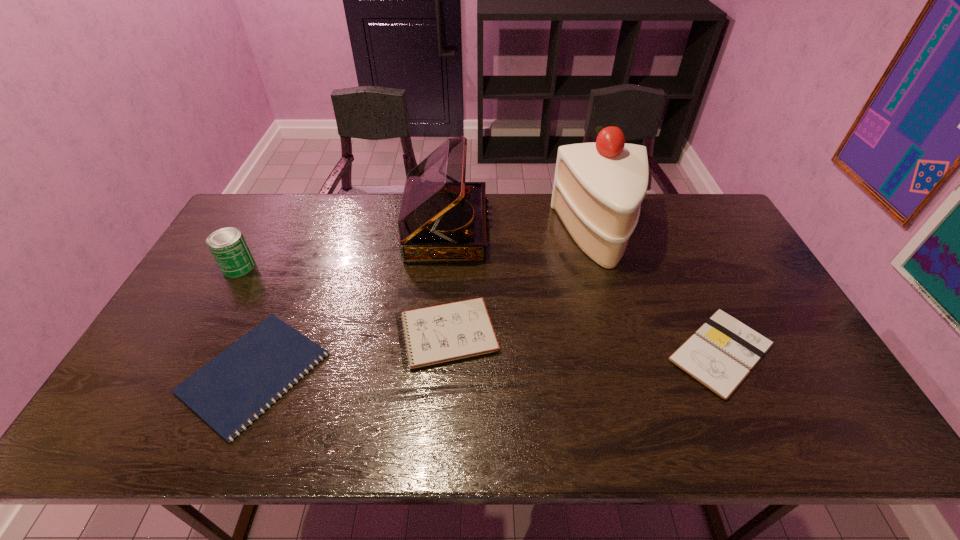
At what (x,y) coordinates should I click in order to perform the action: click on cake. Please return your answer as a coordinate pair (x, y). The width and height of the screenshot is (960, 540). Looking at the image, I should click on (598, 188).

Image resolution: width=960 pixels, height=540 pixels. Identify the location of record player. (442, 218).

This screenshot has width=960, height=540. Find the location of `can`. can is located at coordinates (227, 245).

At what (x,y) coordinates should I click in order to perform the action: click on the third shortest object. Please return your answer as a coordinate pair (x, y). Looking at the image, I should click on (442, 333).

Identify the location of the second notepad from left to right. (442, 333).

I want to click on the fifth tallest object, so click(x=721, y=353).

Where is `the second shortest notepad`? Image resolution: width=960 pixels, height=540 pixels. the second shortest notepad is located at coordinates pos(721,353).

The width and height of the screenshot is (960, 540). I want to click on the leftmost notepad, so click(x=259, y=368).

This screenshot has width=960, height=540. I want to click on the shortest notepad, so click(259, 368).

What are the coordinates of `vacant region located 0.160m on the front of the cake` in the screenshot? It's located at (621, 311).